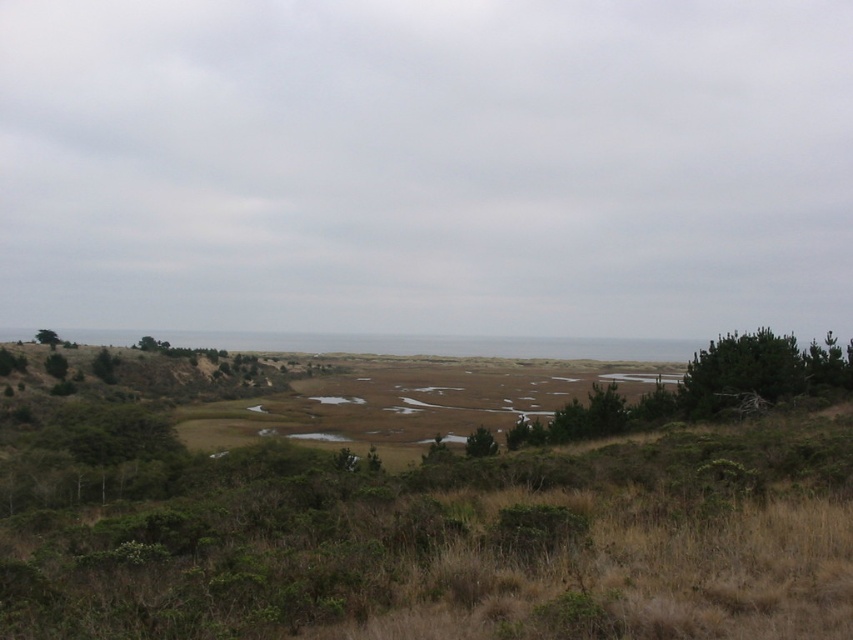
You are standing in the open landscape and want to walk towards the ocean. You see the green matte tree at center and the green matte tree at upper left. Which tree should you head towards to get closer to the ocean faster?

The green matte tree at center is closer to the viewer than the green matte tree at upper left, so heading towards the green matte tree at center will get you closer to the ocean faster.

You are an environmental scientist assessing the landscape. You notice two green matte trees in the scene. Which tree has a smaller width? The green matte tree at right or the green matte tree at upper left?

The green matte tree at right has a lesser width compared to the green matte tree at upper left, so the green matte tree at right is smaller in width.